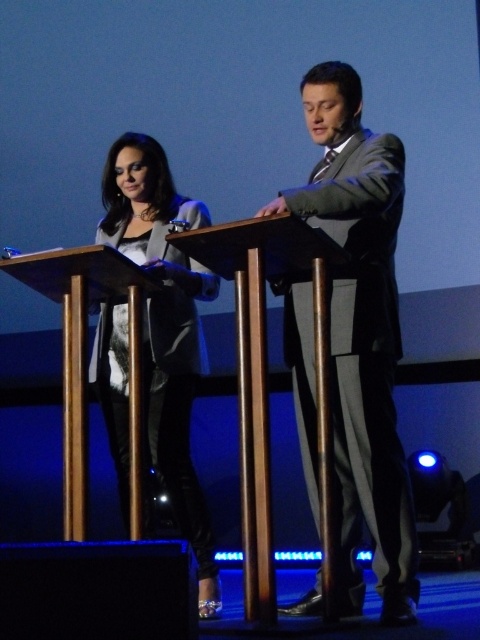
Question: Does matte gray suit at center have a lesser width compared to matte black jacket at center?

Choices:
 (A) no
 (B) yes

Answer: (A)

Question: Does matte gray suit at center appear on the right side of matte black jacket at center?

Choices:
 (A) yes
 (B) no

Answer: (A)

Question: Among these points, which one is farthest from the camera?

Choices:
 (A) (181, 468)
 (B) (343, 140)

Answer: (A)

Question: Can you confirm if matte gray suit at center is positioned above matte black jacket at center?

Choices:
 (A) no
 (B) yes

Answer: (B)

Question: Which object is farther from the camera taking this photo?

Choices:
 (A) matte gray suit at center
 (B) matte black jacket at center

Answer: (B)